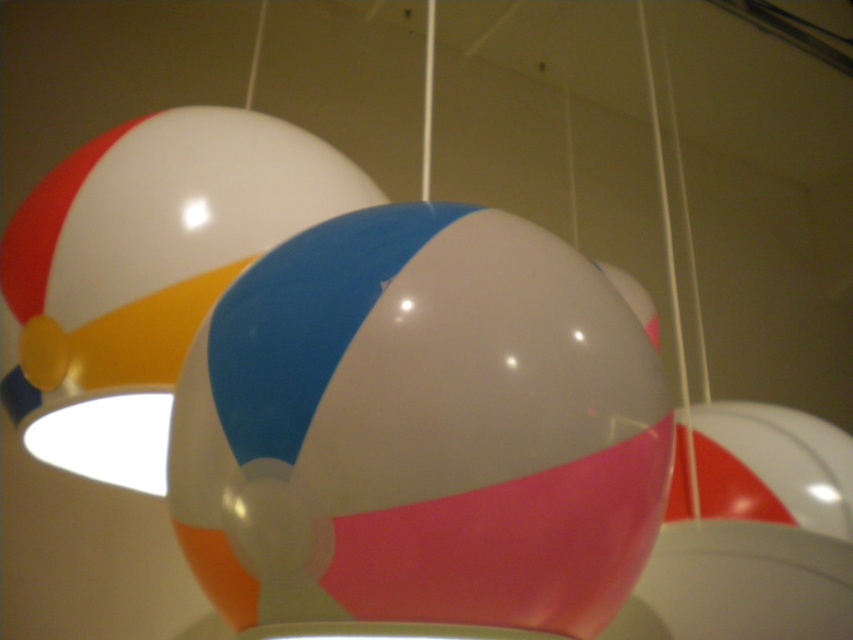
You are standing in a room with several beach balls hanging from the ceiling. You see a point at coordinates (421, 429). Which object is this point located on?

The point at coordinates (421, 429) is located on the glossy plastic ball at center.

You are setting up decorations for a party and notice two plastic balls hanging above the entrance. The glossy plastic ball at center and the shiny plastic ball at center. Which one is hanging lower?

The glossy plastic ball at center is positioned under the shiny plastic ball at center, so it is hanging lower.

You are setting up a display for a party and have two beach balls, the glossy plastic ball at center and the shiny plastic ball at center. Which one is smaller in height?

The glossy plastic ball at center is not as tall as the shiny plastic ball at center, so the glossy plastic ball at center is smaller in height.